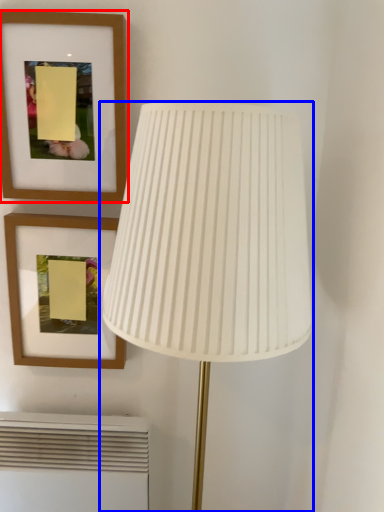
Question: Which object appears farthest to the camera in this image, picture frame (highlighted by a red box) or lamp (highlighted by a blue box)?

Choices:
 (A) picture frame
 (B) lamp

Answer: (A)